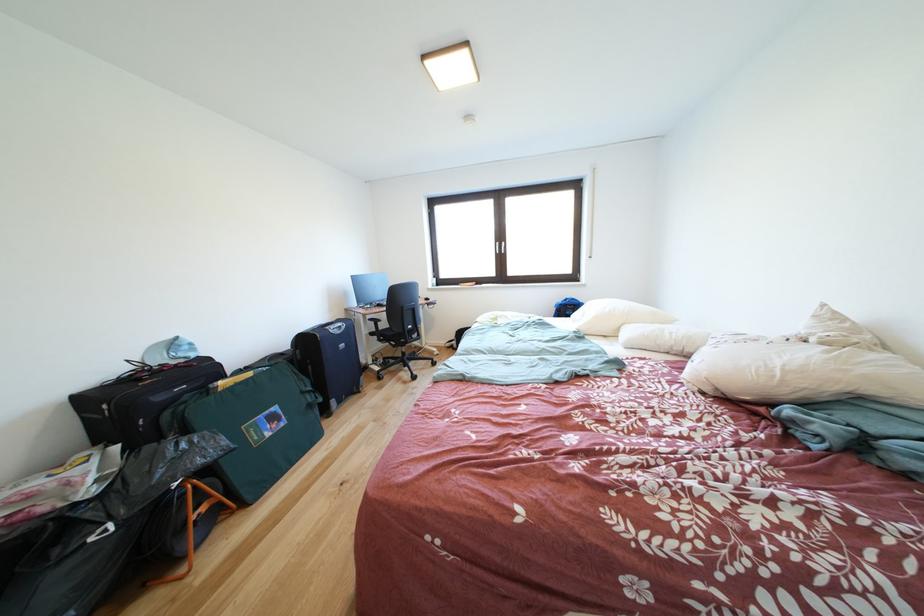
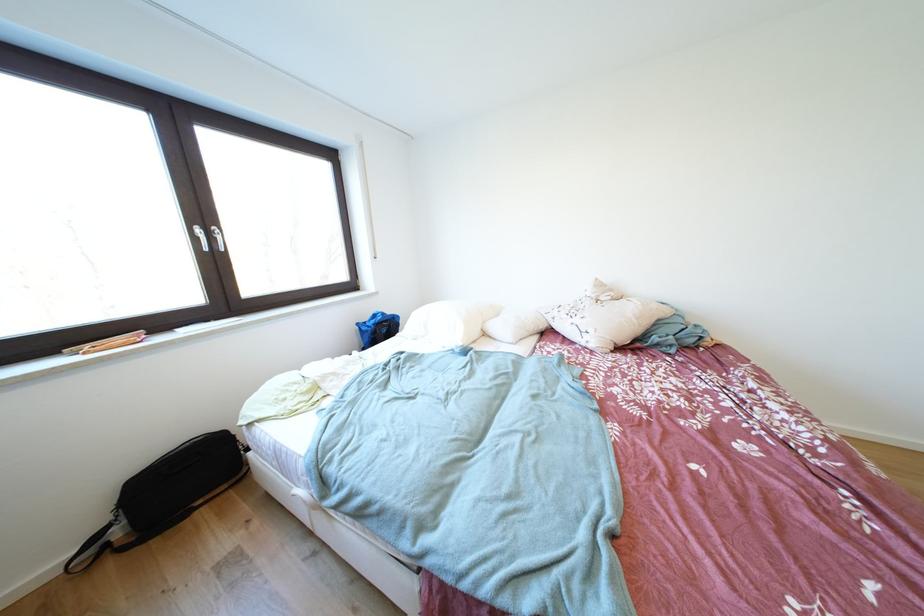
In the second image, find the point that corresponds to [661,329] in the first image.

(505, 320)